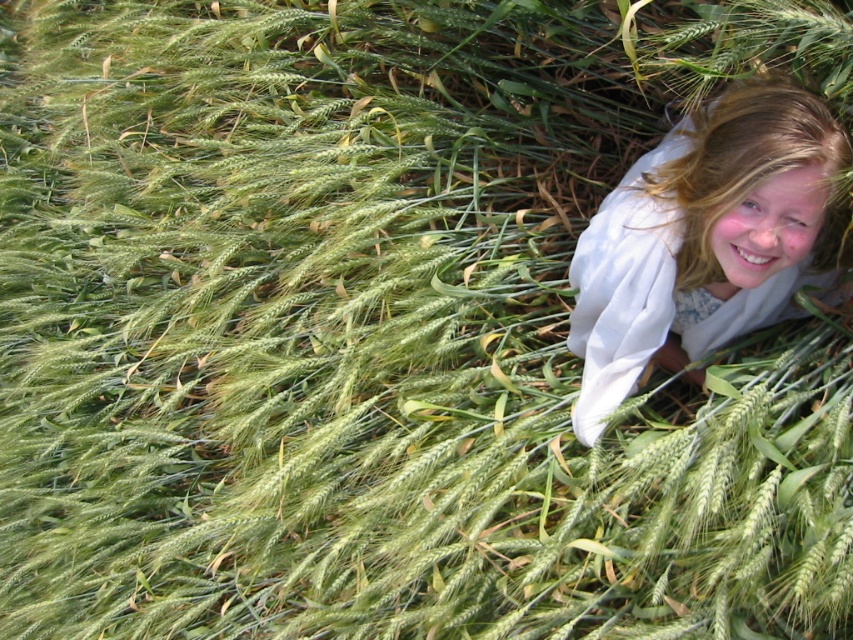
Question: Which point is farther to the camera?

Choices:
 (A) light brown hair at upper right
 (B) blonde hair at upper right

Answer: (A)

Question: From the image, what is the correct spatial relationship of light brown hair at upper right in relation to blonde hair at upper right?

Choices:
 (A) below
 (B) above

Answer: (A)

Question: Which point appears closest to the camera in this image?

Choices:
 (A) (849, 264)
 (B) (792, 269)

Answer: (B)

Question: Is light brown hair at upper right smaller than blonde hair at upper right?

Choices:
 (A) yes
 (B) no

Answer: (B)

Question: Does light brown hair at upper right lie behind blonde hair at upper right?

Choices:
 (A) yes
 (B) no

Answer: (A)